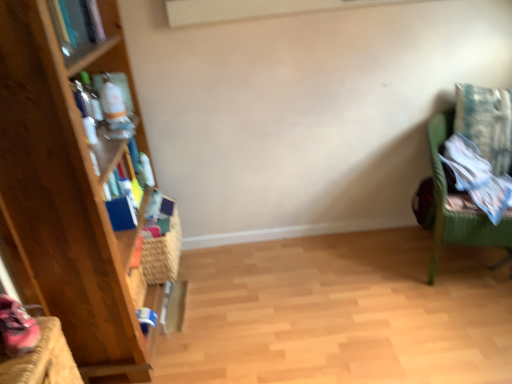
Locate an element on the screen. matte blue book at upper left is located at coordinates (76, 21).

What do you see at coordinates (163, 253) in the screenshot?
I see `woven straw basket at left` at bounding box center [163, 253].

Find the location of a particular element. This screenshot has width=512, height=384. matte blue book at upper left is located at coordinates (76, 21).

Where is `book above the woven straw basket at left (from a real-world perspective)`? This screenshot has width=512, height=384. book above the woven straw basket at left (from a real-world perspective) is located at coordinates (76, 21).

Is woven straw basket at left smaller than matte blue book at upper left?

No, woven straw basket at left is not smaller than matte blue book at upper left.

Is matte blue book at upper left at the back of woven straw basket at left?

That's not correct — woven straw basket at left is not looking away from matte blue book at upper left.

Considering the relative sizes of woven straw basket at left and matte blue book at upper left in the image provided, is woven straw basket at left thinner than matte blue book at upper left?

No.

From the image's perspective, is wooden bookcase at left located above green wicker chair at right?

Yes, from the image's perspective, wooden bookcase at left is above green wicker chair at right.

Does wooden bookcase at left have a lesser height compared to green wicker chair at right?

No, wooden bookcase at left is not shorter than green wicker chair at right.

Between wooden bookcase at left and green wicker chair at right, which one has larger width?

green wicker chair at right is wider.

Does wooden bookcase at left appear on the left side of woven straw basket at left?

Yes.

Is wooden bookcase at left wider or thinner than woven straw basket at left?

wooden bookcase at left is wider than woven straw basket at left.

This screenshot has width=512, height=384. In order to click on bookcase above the woven straw basket at left (from a real-world perspective) in this screenshot , I will do `click(66, 193)`.

Is wooden bookcase at left next to woven straw basket at left and touching it?

No, wooden bookcase at left is not beside woven straw basket at left.

Is woven straw basket at left not within green wicker chair at right?

Indeed, woven straw basket at left is completely outside green wicker chair at right.

Between woven straw basket at left and green wicker chair at right, which one has larger width?

green wicker chair at right is wider.

Based on their sizes in the image, would you say woven straw basket at left is bigger or smaller than green wicker chair at right?

Considering their sizes, woven straw basket at left takes up less space than green wicker chair at right.

Visually, is woven straw basket at left positioned to the left or to the right of green wicker chair at right?

Clearly, woven straw basket at left is on the left of green wicker chair at right in the image.

Is wooden bookcase at left oriented towards matte blue book at upper left?

Yes, wooden bookcase at left faces towards matte blue book at upper left.

Considering the sizes of wooden bookcase at left and matte blue book at upper left in the image, is wooden bookcase at left wider or thinner than matte blue book at upper left?

Clearly, wooden bookcase at left has more width compared to matte blue book at upper left.

Is wooden bookcase at left smaller than matte blue book at upper left?

Incorrect, wooden bookcase at left is not smaller in size than matte blue book at upper left.

Visually, is wooden bookcase at left positioned to the left or to the right of matte blue book at upper left?

In the image, wooden bookcase at left appears on the right side of matte blue book at upper left.

Is green wicker chair at right outside of matte blue book at upper left?

Yes.

Is green wicker chair at right positioned far away from matte blue book at upper left?

Yes, green wicker chair at right is far from matte blue book at upper left.

Does green wicker chair at right appear on the right side of matte blue book at upper left?

Indeed, green wicker chair at right is positioned on the right side of matte blue book at upper left.

Based on the photo, between matte blue book at upper left and green wicker chair at right, which one has larger width?

With larger width is green wicker chair at right.

Which is in front, matte blue book at upper left or green wicker chair at right?

matte blue book at upper left is closer to the camera.

Is matte blue book at upper left bigger than green wicker chair at right?

Actually, matte blue book at upper left might be smaller than green wicker chair at right.

From the image's perspective, would you say matte blue book at upper left is positioned over green wicker chair at right?

Yes, from the image's perspective, matte blue book at upper left is on top of green wicker chair at right.

I want to click on basket below the matte blue book at upper left (from a real-world perspective), so click(x=163, y=253).

This screenshot has height=384, width=512. I want to click on chair behind the wooden bookcase at left, so click(x=483, y=156).

Looking at the image, which one is located further to woven straw basket at left, green wicker chair at right or matte blue book at upper left?

Based on the image, green wicker chair at right appears to be further to woven straw basket at left.

Looking at the image, which one is located closer to wooden bookcase at left, matte blue book at upper left or woven straw basket at left?

woven straw basket at left lies closer to wooden bookcase at left than the other object.

When comparing their distances from matte blue book at upper left, does woven straw basket at left or green wicker chair at right seem closer?

woven straw basket at left is closer to matte blue book at upper left.

Based on their spatial positions, is woven straw basket at left or green wicker chair at right closer to wooden bookcase at left?

Based on the image, woven straw basket at left appears to be nearer to wooden bookcase at left.

In the scene shown: Based on their spatial positions, is green wicker chair at right or woven straw basket at left closer to matte blue book at upper left?

The object closer to matte blue book at upper left is woven straw basket at left.

Based on their spatial positions, is wooden bookcase at left or matte blue book at upper left further from green wicker chair at right?

The object further to green wicker chair at right is matte blue book at upper left.

Which object lies nearer to the anchor point green wicker chair at right, woven straw basket at left or wooden bookcase at left?

woven straw basket at left is closer to green wicker chair at right.

From the image, which object appears to be farther from matte blue book at upper left, wooden bookcase at left or green wicker chair at right?

Based on the image, green wicker chair at right appears to be further to matte blue book at upper left.

The height and width of the screenshot is (384, 512). I want to click on bookcase between matte blue book at upper left and green wicker chair at right in the horizontal direction, so click(66, 193).

At what (x,y) coordinates should I click in order to perform the action: click on basket between matte blue book at upper left and green wicker chair at right. Please return your answer as a coordinate pair (x, y). Looking at the image, I should click on (163, 253).

Where is `basket between wooden bookcase at left and green wicker chair at right in the horizontal direction`? This screenshot has width=512, height=384. basket between wooden bookcase at left and green wicker chair at right in the horizontal direction is located at coordinates coord(163,253).

You are a GUI agent. You are given a task and a screenshot of the screen. Output one action in this format:
    pyautogui.click(x=<x>, y=<y>)
    Task: Click on the bookcase between matte blue book at upper left and woven straw basket at left vertically
    The height and width of the screenshot is (384, 512).
    Given the screenshot: What is the action you would take?
    pyautogui.click(x=66, y=193)